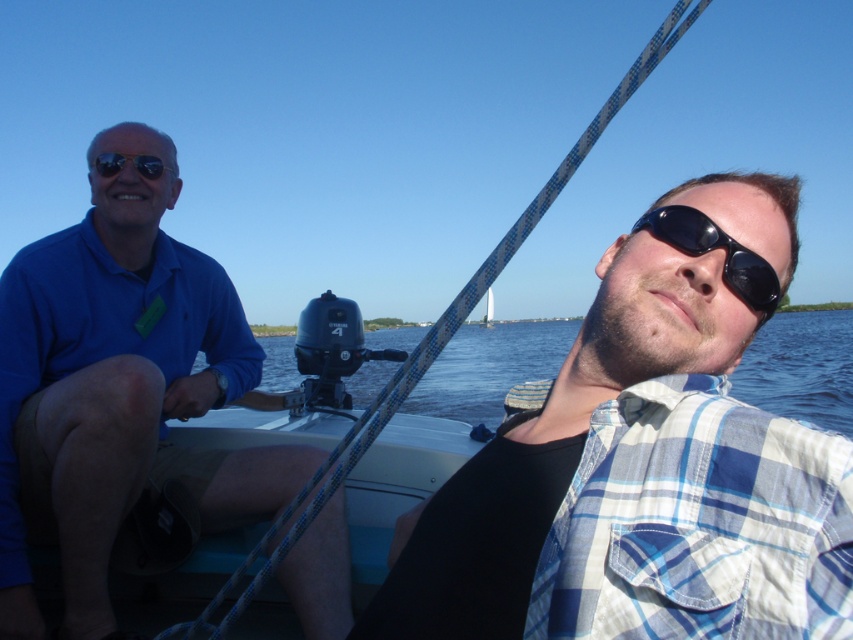
Question: Does matte blue shirt at left have a larger size compared to blue water at center?

Choices:
 (A) yes
 (B) no

Answer: (B)

Question: Can you confirm if blue water at center is smaller than matte black sunglasses at upper left?

Choices:
 (A) yes
 (B) no

Answer: (B)

Question: Considering the real-world distances, which object is farthest from the blue plaid shirt at center?

Choices:
 (A) blue water at center
 (B) black reflective sunglasses at center
 (C) matte blue shirt at left
 (D) matte black sunglasses at upper left

Answer: (A)

Question: Can you confirm if blue water at center is positioned below matte black sunglasses at upper left?

Choices:
 (A) no
 (B) yes

Answer: (B)

Question: Which object is closer to the camera taking this photo?

Choices:
 (A) matte black sunglasses at upper left
 (B) matte blue shirt at left
 (C) blue plaid shirt at center
 (D) blue water at center

Answer: (C)

Question: Which of the following is the farthest from the observer?

Choices:
 (A) blue water at center
 (B) matte black sunglasses at upper left

Answer: (B)